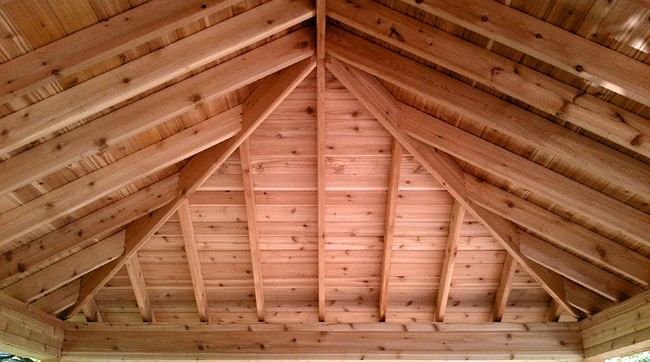
Image resolution: width=650 pixels, height=362 pixels. What are the coordinates of `crossbeams on right side of ceiling` in the screenshot? It's located at (588, 306), (593, 284), (604, 259), (604, 213), (604, 157), (602, 121), (604, 73).